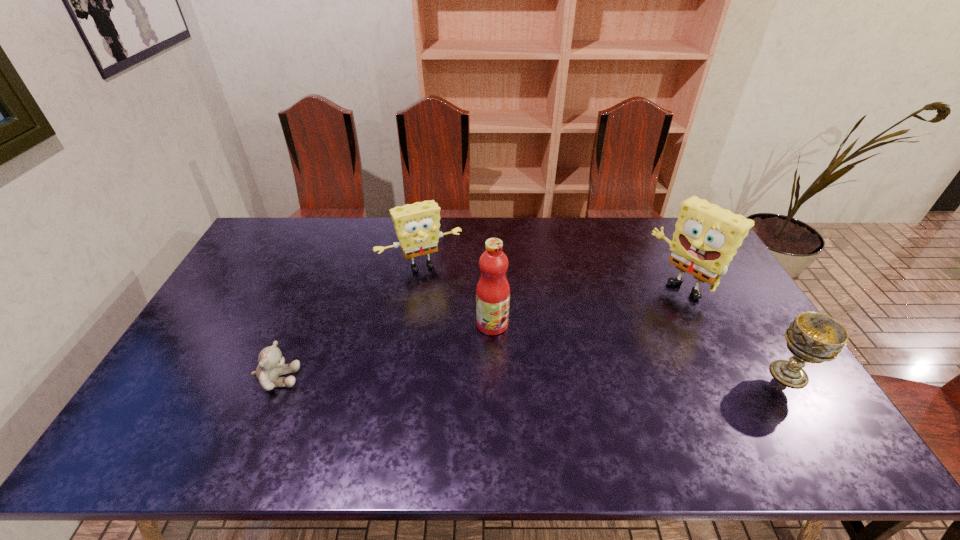
Identify the location of free space located 0.100m on the front label of the third nearest object. (528, 354).

I want to click on object at the far edge, so click(417, 225).

This screenshot has width=960, height=540. Identify the location of teddy bear present at the near edge. (271, 365).

Where is `chalice at the near edge`? The width and height of the screenshot is (960, 540). chalice at the near edge is located at coordinates coord(812,337).

The width and height of the screenshot is (960, 540). I want to click on chalice that is at the right edge, so click(812, 337).

Identify the location of sponge at the right edge. (706, 239).

The width and height of the screenshot is (960, 540). In order to click on object situated at the near right corner in this screenshot , I will do `click(812, 337)`.

You are a GUI agent. You are given a task and a screenshot of the screen. Output one action in this format:
    pyautogui.click(x=<x>, y=<y>)
    Task: Click on the vacant space at the far edge of the desktop
    
    Given the screenshot: What is the action you would take?
    pyautogui.click(x=326, y=220)

The image size is (960, 540). Find the location of `vacant space at the near edge of the desktop`. vacant space at the near edge of the desktop is located at coordinates (448, 390).

In the image, there is a desktop. Identify the location of vacant space at the left edge. (230, 287).